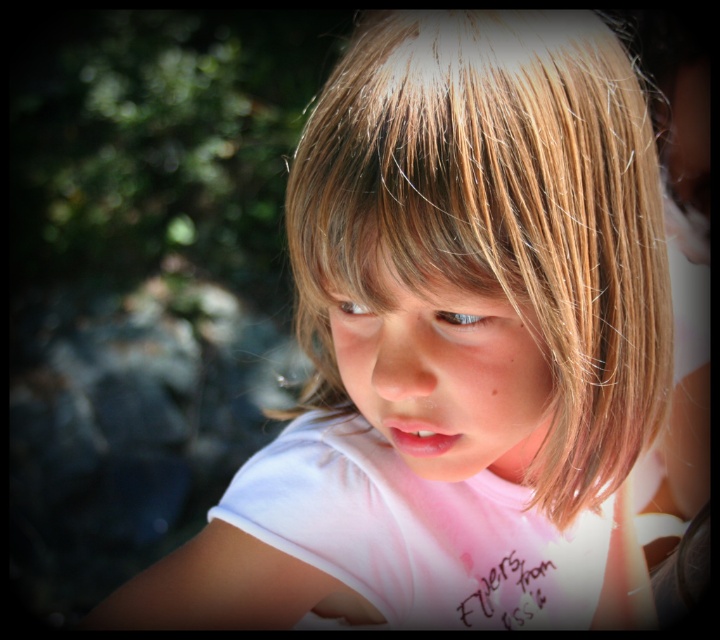
Question: Is blue glossy eye at center to the left of brown matte eye at center from the viewer's perspective?

Choices:
 (A) yes
 (B) no

Answer: (B)

Question: Among these objects, which one is farthest from the camera?

Choices:
 (A) smooth skin face at center
 (B) blue glossy eye at center

Answer: (B)

Question: Which object is farther from the camera taking this photo?

Choices:
 (A) smooth skin face at center
 (B) blue glossy eye at center
 (C) brown matte eye at center

Answer: (C)

Question: Among these points, which one is farthest from the camera?

Choices:
 (A) (438, 320)
 (B) (338, 298)

Answer: (B)

Question: Is smooth skin face at center smaller than brown matte eye at center?

Choices:
 (A) no
 (B) yes

Answer: (A)

Question: From the image, what is the correct spatial relationship of smooth skin face at center in relation to brown matte eye at center?

Choices:
 (A) left
 (B) right

Answer: (B)